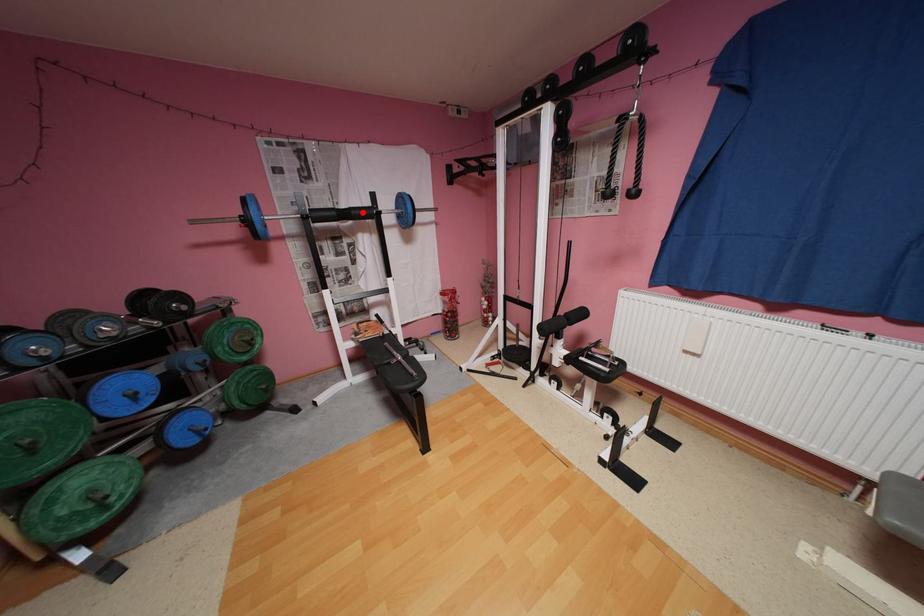
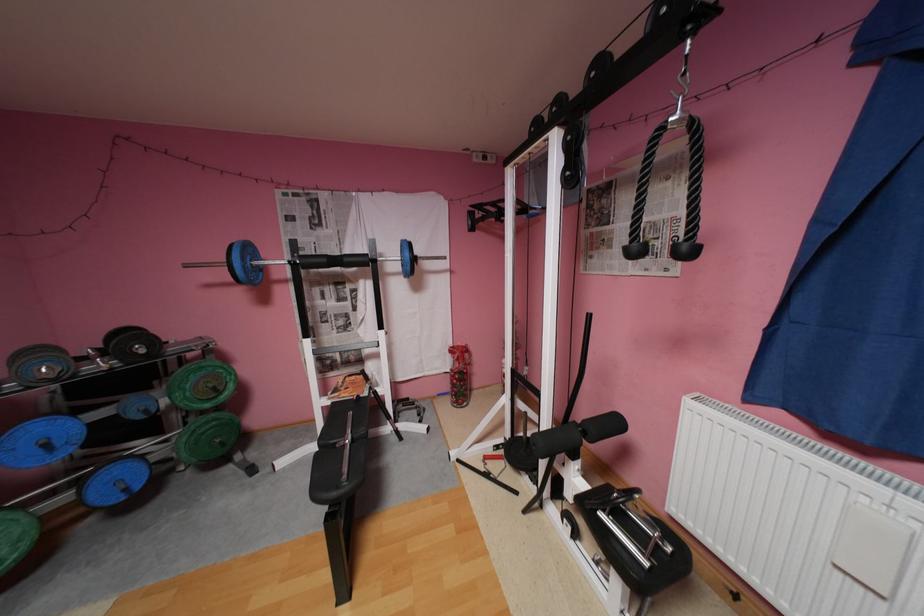
Find the pixel in the second image that matches the highlighted location in the first image.

(355, 259)